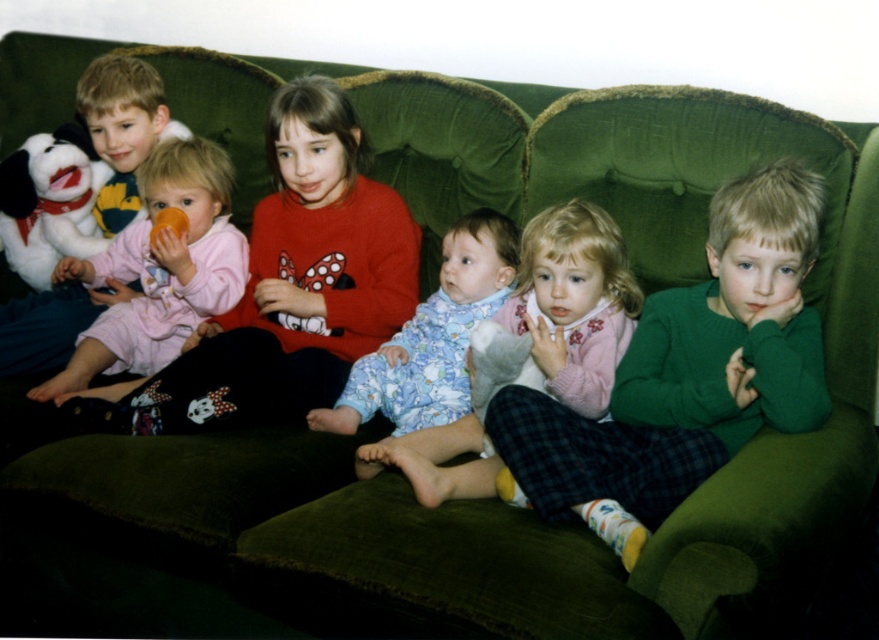
Question: Can you confirm if pink fleece onesie at left is positioned to the left of fluffy blue pajamas at center?

Choices:
 (A) yes
 (B) no

Answer: (A)

Question: Based on their relative distances, which object is farther from the fluffy blue pajamas at center?

Choices:
 (A) fluffy white teddy bear at center
 (B) white plush toy at left

Answer: (B)

Question: Which object appears farthest from the camera in this image?

Choices:
 (A) green cotton shirt at center
 (B) pink fleece onesie at left
 (C) fluffy white teddy bear at center

Answer: (B)

Question: Observing the image, what is the correct spatial positioning of green cotton shirt at center in reference to white plush toy at left?

Choices:
 (A) right
 (B) left

Answer: (A)

Question: Which of the following is the farthest from the observer?

Choices:
 (A) (12, 241)
 (B) (615, 284)
 (C) (422, 368)
 (D) (162, 144)

Answer: (A)

Question: Can you confirm if green cotton shirt at center is positioned to the right of pink fleece onesie at left?

Choices:
 (A) no
 (B) yes

Answer: (B)